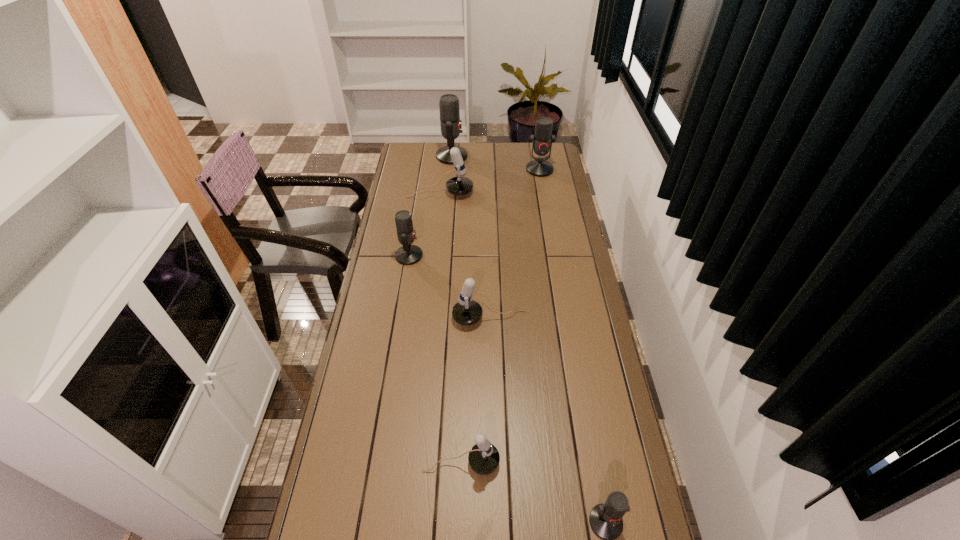
Locate an element on the screen. the sixth farthest microphone is located at coordinates (483, 458).

At what (x,y) coordinates should I click in order to perform the action: click on free space located on the side of the tallest microphone with the red ring. Please return your answer as a coordinate pair (x, y). The image size is (960, 540). Looking at the image, I should click on click(x=505, y=156).

Identify the location of free space located on the side of the second biggest red microphone with the red ring. The image size is (960, 540). (542, 187).

Locate an element on the screen. The image size is (960, 540). free spot located on the front of the third farthest object is located at coordinates (436, 234).

The image size is (960, 540). What are the coordinates of `free space located on the side of the fourth nearest microphone with the red ring` in the screenshot? It's located at (492, 256).

I want to click on vacant area situated on the back of the second smallest white microphone, so click(489, 297).

The width and height of the screenshot is (960, 540). In order to click on free location located 0.200m on the back of the sixth farthest microphone in this screenshot , I will do `click(464, 386)`.

You are a GUI agent. You are given a task and a screenshot of the screen. Output one action in this format:
    pyautogui.click(x=<x>, y=<y>)
    Task: Click on the object that is at the right edge
    The height and width of the screenshot is (540, 960).
    Given the screenshot: What is the action you would take?
    pyautogui.click(x=542, y=140)

Find the location of `object at the far right corner`. object at the far right corner is located at coordinates (542, 140).

At what (x,y) coordinates should I click in order to perform the action: click on free space at the far edge. Please return your answer as a coordinate pair (x, y). Looking at the image, I should click on (491, 152).